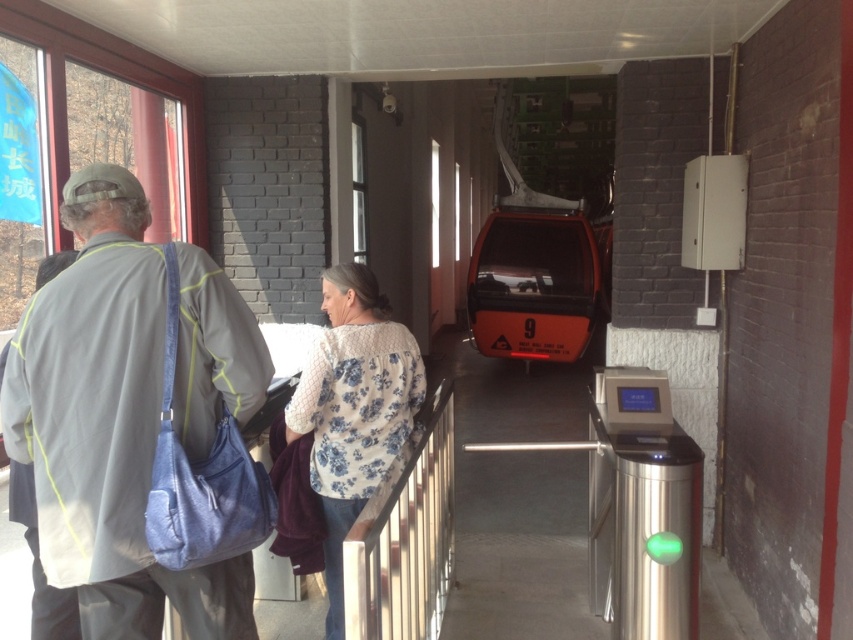
Question: Considering the relative positions of floral-patterned sweater at center and orange matte cable car at center in the image provided, where is floral-patterned sweater at center located with respect to orange matte cable car at center?

Choices:
 (A) right
 (B) left

Answer: (B)

Question: Which is farther from the floral-patterned sweater at center?

Choices:
 (A) light gray fabric jacket at left
 (B) orange matte cable car at center

Answer: (B)

Question: Which point is farther to the camera?

Choices:
 (A) orange matte cable car at center
 (B) light gray fabric jacket at left

Answer: (A)

Question: Which of the following is the closest to the observer?

Choices:
 (A) (334, 284)
 (B) (535, 234)
 (C) (4, 420)

Answer: (C)

Question: Is light gray fabric jacket at left wider than floral-patterned sweater at center?

Choices:
 (A) yes
 (B) no

Answer: (A)

Question: Does floral-patterned sweater at center appear on the left side of orange matte cable car at center?

Choices:
 (A) yes
 (B) no

Answer: (A)